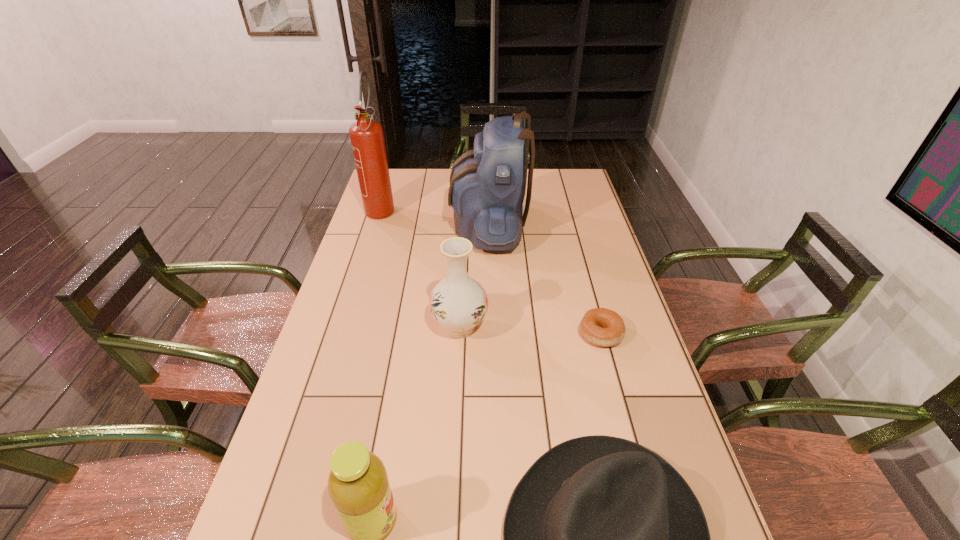
Find the location of `free point between the shortest object and the vase`. free point between the shortest object and the vase is located at coordinates (530, 330).

Locate an element on the screen. This screenshot has height=540, width=960. free space between the leftmost object and the backpack is located at coordinates (435, 217).

At what (x,y) coordinates should I click in order to perform the action: click on free space between the bagel and the second tallest object. Please return your answer as a coordinate pair (x, y). Looking at the image, I should click on (544, 280).

At what (x,y) coordinates should I click in order to perform the action: click on free spot between the fire extinguisher and the bagel. Please return your answer as a coordinate pair (x, y). Looking at the image, I should click on (491, 271).

The height and width of the screenshot is (540, 960). What are the coordinates of `blank region between the vase and the leftmost object` in the screenshot? It's located at 420,267.

Locate an element on the screen. The image size is (960, 540). vacant area between the leftmost object and the second tallest object is located at coordinates (435, 217).

Locate an element on the screen. The height and width of the screenshot is (540, 960). object that can be found as the closest to the vase is located at coordinates (487, 188).

Choose which object is the fourth nearest neighbor to the fifth object from right to left. Please provide its 2D coordinates. Your answer should be formatted as a tuple, i.e. [(x, y)], where the tuple contains the x and y coordinates of a point satisfying the conditions above.

[(487, 188)]

Locate an element on the screen. The width and height of the screenshot is (960, 540). free region that satisfies the following two spatial constraints: 1. at the front pocket of the backpack; 2. on the right side of the bagel is located at coordinates (491, 334).

Identify the location of free location that satisfies the following two spatial constraints: 1. at the front pocket of the bagel; 2. on the left side of the backpack. Image resolution: width=960 pixels, height=540 pixels. (491, 334).